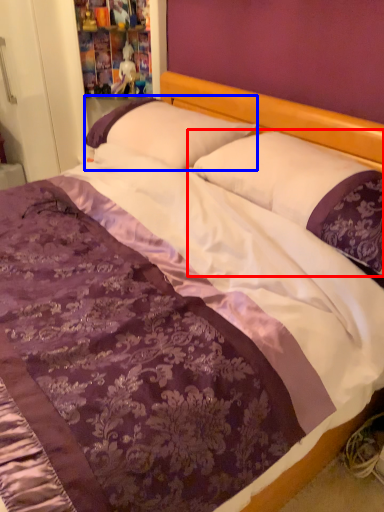
Question: Which object is further to the camera taking this photo, pillow (highlighted by a red box) or pillow (highlighted by a blue box)?

Choices:
 (A) pillow
 (B) pillow

Answer: (B)